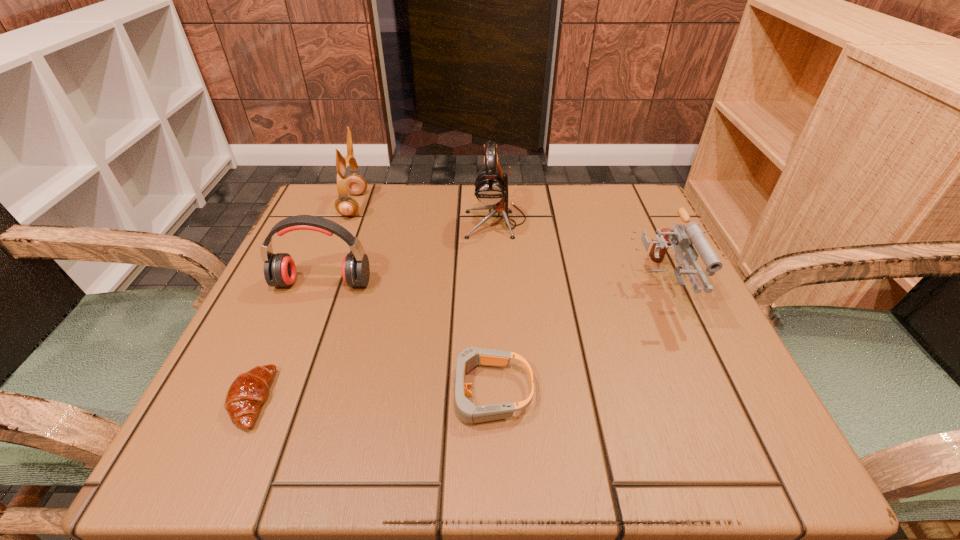
The width and height of the screenshot is (960, 540). I want to click on vacant position located 0.200m on the front and back of the goggles, so click(x=306, y=392).

Identify the location of blank space located on the right of the crescent roll. (311, 399).

The height and width of the screenshot is (540, 960). Find the location of `goggles present at the near edge`. goggles present at the near edge is located at coordinates (467, 412).

The height and width of the screenshot is (540, 960). I want to click on crescent roll located at the near edge, so click(249, 390).

Where is `crescent roll that is at the left edge`? Image resolution: width=960 pixels, height=540 pixels. crescent roll that is at the left edge is located at coordinates (249, 390).

Identify the location of object that is at the right edge. (681, 237).

Where is `object present at the far left corner`? The width and height of the screenshot is (960, 540). object present at the far left corner is located at coordinates (355, 184).

Locate an element on the screen. object that is at the near left corner is located at coordinates (249, 390).

Identify the location of free spot at the far edge of the desktop. This screenshot has height=540, width=960. (556, 207).

Where is `vacant space at the near edge`? vacant space at the near edge is located at coordinates [589, 415].